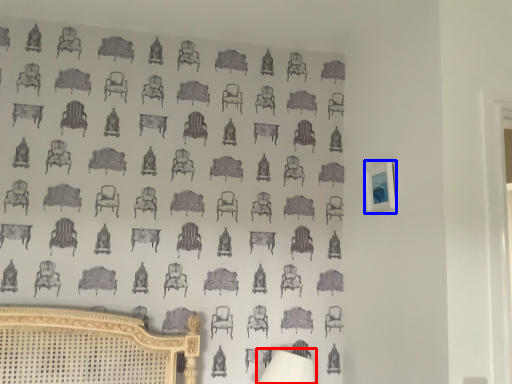
Question: Which object is further to the camera taking this photo, table lamp (highlighted by a red box) or picture frame (highlighted by a blue box)?

Choices:
 (A) table lamp
 (B) picture frame

Answer: (A)